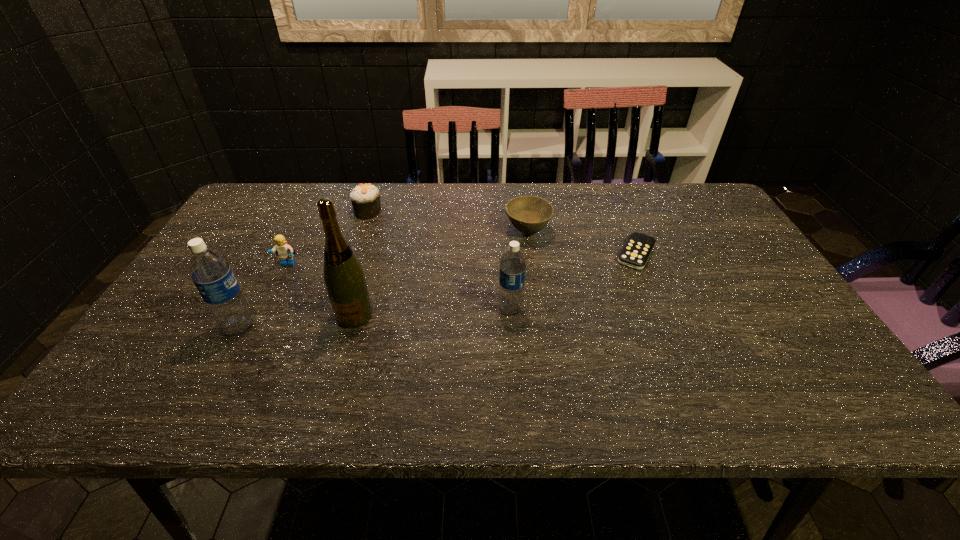
The height and width of the screenshot is (540, 960). I want to click on vacant space at the near edge of the desktop, so click(x=372, y=362).

In the image, there is a desktop. Where is `vacant space at the left edge`? The height and width of the screenshot is (540, 960). vacant space at the left edge is located at coordinates (225, 228).

In the image, there is a desktop. Identify the location of blank space at the right edge. (731, 230).

Locate an element on the screen. vacant region at the far left corner is located at coordinates (276, 206).

You are a GUI agent. You are given a task and a screenshot of the screen. Output one action in this format:
    pyautogui.click(x=<x>, y=<y>)
    Task: Click on the free region at the near left corner
    The width and height of the screenshot is (960, 540).
    Given the screenshot: What is the action you would take?
    pyautogui.click(x=156, y=346)

At what (x,y) coordinates should I click in order to perform the action: click on free point at the far right corner. Please return your answer as a coordinate pair (x, y). The image size is (960, 540). Looking at the image, I should click on (705, 205).

Find the location of a particular element. vacant point located between the cupcake and the wine bottle is located at coordinates (361, 264).

At what (x,y) coordinates should I click in order to perform the action: click on vacant point located between the sixth shortest object and the rightmost object. Please return your answer as a coordinate pair (x, y). Looking at the image, I should click on (438, 290).

Identify the location of vacant space in between the shortest object and the shorter water bottle. This screenshot has height=540, width=960. (573, 281).

In order to click on blank region between the Lego and the left water bottle in this screenshot , I will do `click(264, 295)`.